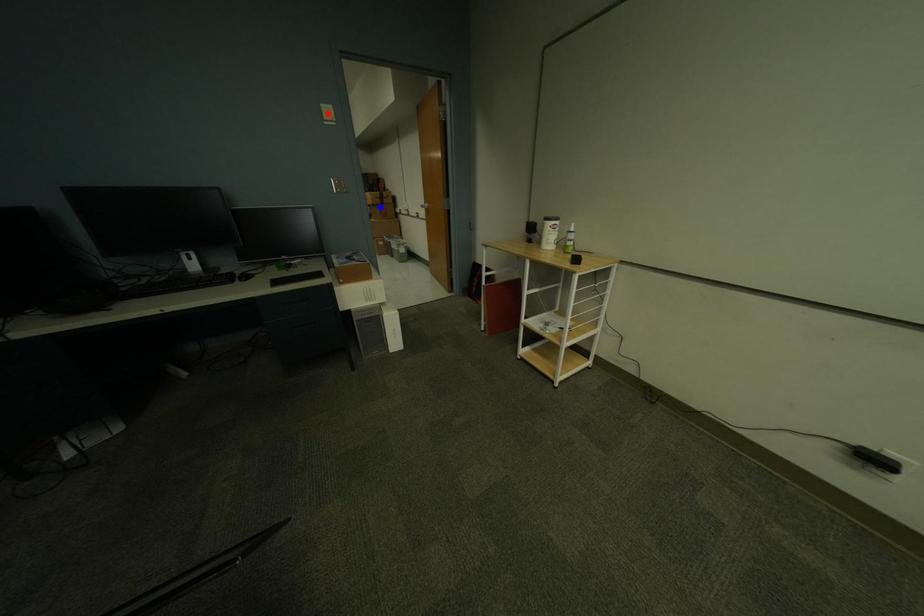
Question: Two points are marked on the image. Which point is closer to the camera?

Choices:
 (A) Blue point is closer.
 (B) Red point is closer.

Answer: (B)